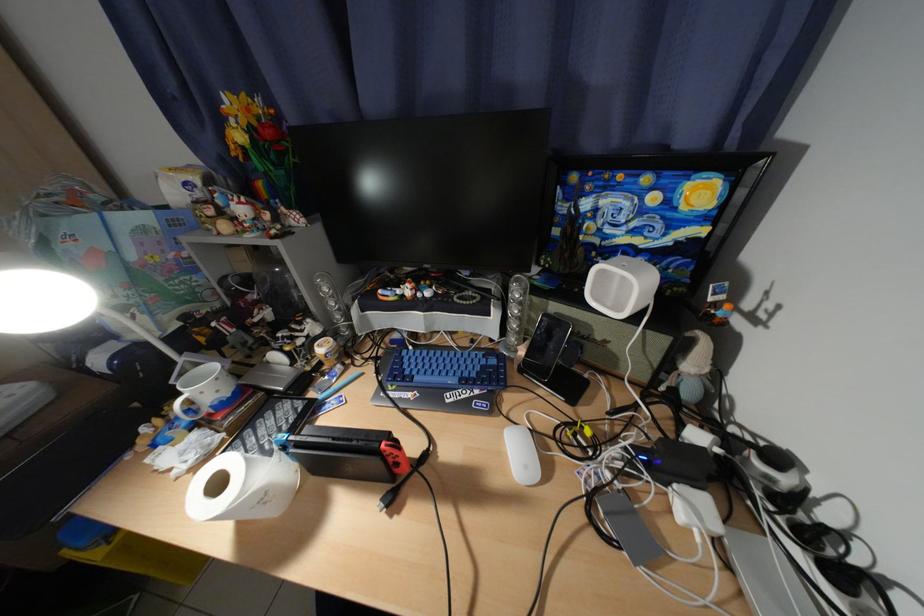
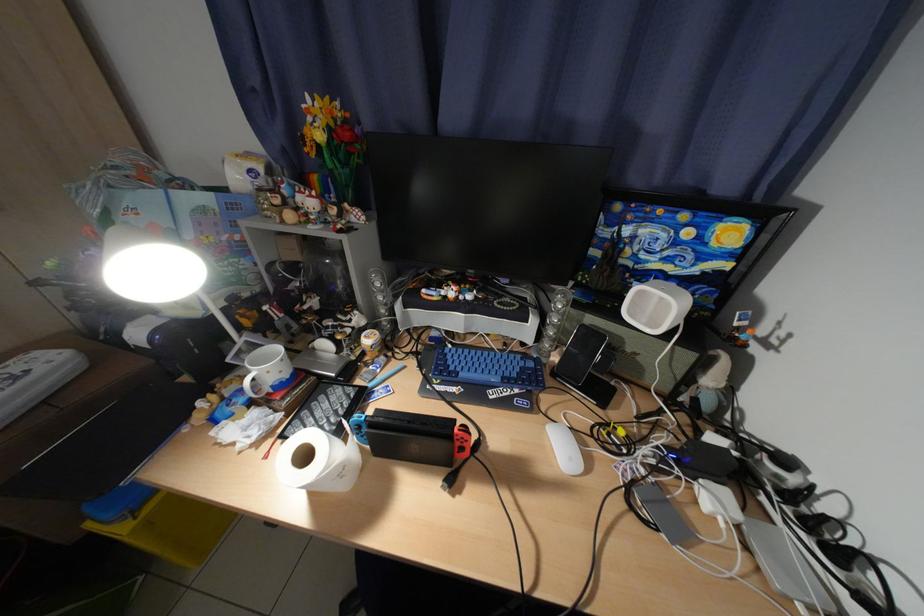
Where in the second image is the point corresponding to pixel 538 469 from the first image?

(582, 460)